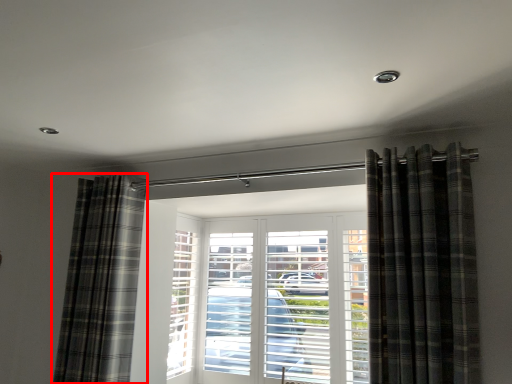
Question: From the image's perspective, where is curtain (annotated by the red box) located in relation to curtain in the image?

Choices:
 (A) above
 (B) below

Answer: (B)